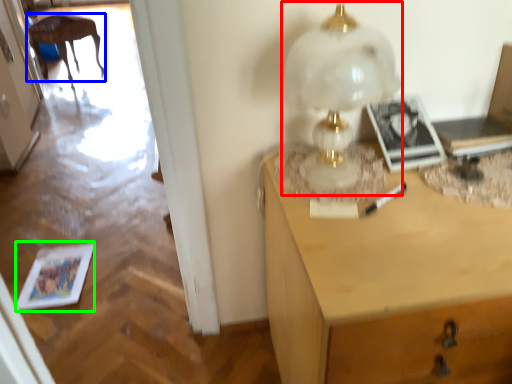
Question: Which object is the farthest from table lamp (highlighted by a red box)? Choose among these: furniture (highlighted by a blue box) or magazine (highlighted by a green box).

Choices:
 (A) furniture
 (B) magazine

Answer: (A)